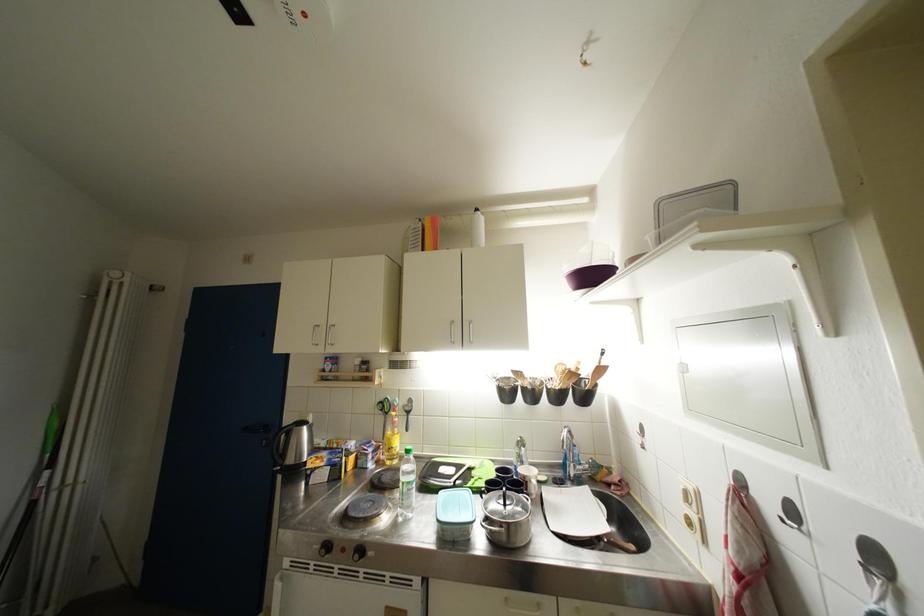
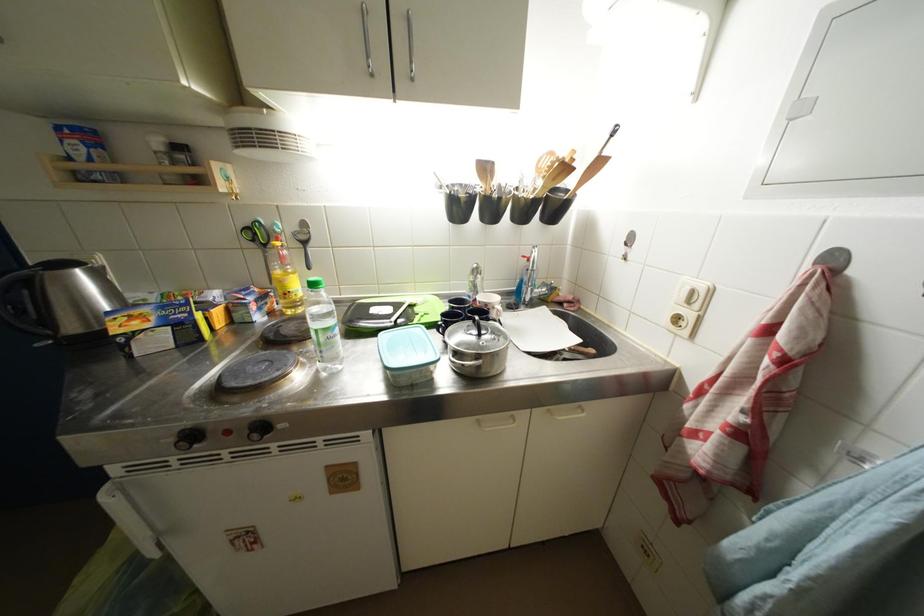
Locate, in the second image, the point that corresponds to pixel 368 554 in the first image.

(269, 431)